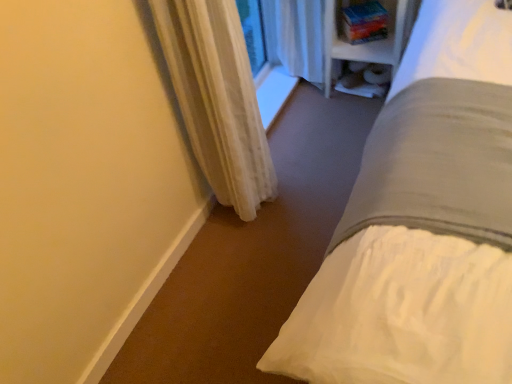
Image resolution: width=512 pixels, height=384 pixels. What are the coordinates of `free point above white fabric shelf at upper right (from a real-world perspective)` in the screenshot? It's located at [360, 82].